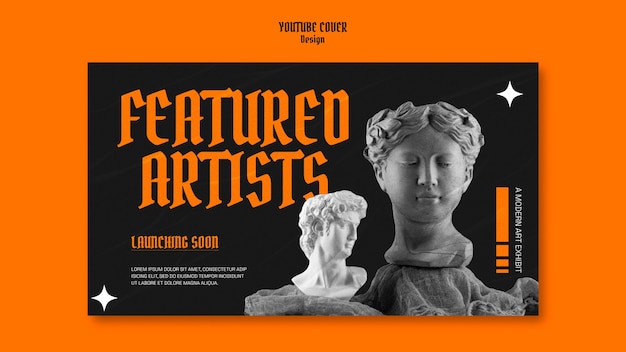
At what (x,y) coordinates should I click in order to perform the action: click on cloth under sculpture. Please return your answer as a coordinate pair (x, y). Looking at the image, I should click on (428, 310), (292, 307).